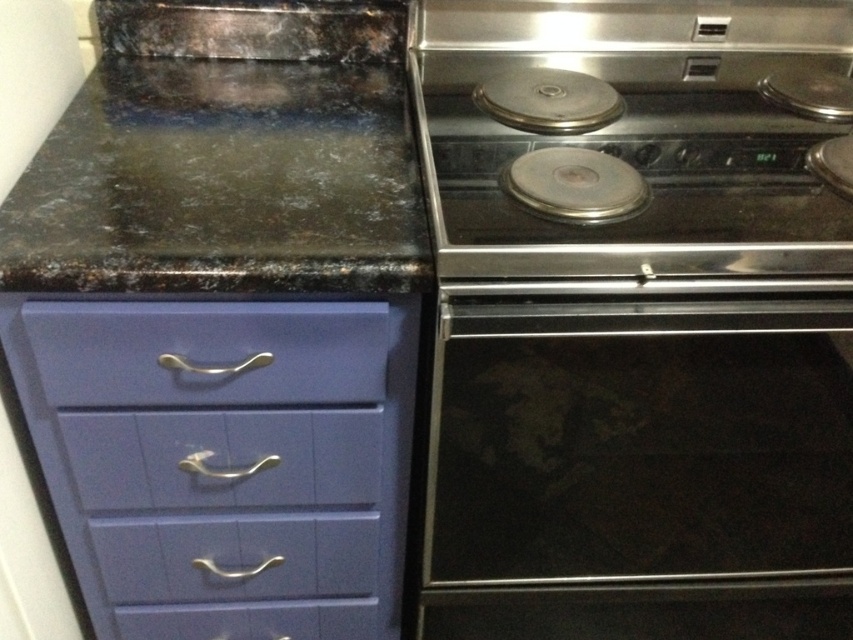
You are a kitchen designer planning to place a new appliance between the black glass oven at center and the matte purple drawer at center. Given their widths, which appliance should be placed closer to the wider object to maintain balance?

The black glass oven at center is wider than the matte purple drawer at center. To maintain balance, the new appliance should be placed closer to the black glass oven at center since it has a larger width and requires more space.

You are trying to locate the oven in the kitchen. According to the image, where is the black glass oven at center in relation to the matte purple drawer at center?

The black glass oven at center is positioned under the matte purple drawer at center.